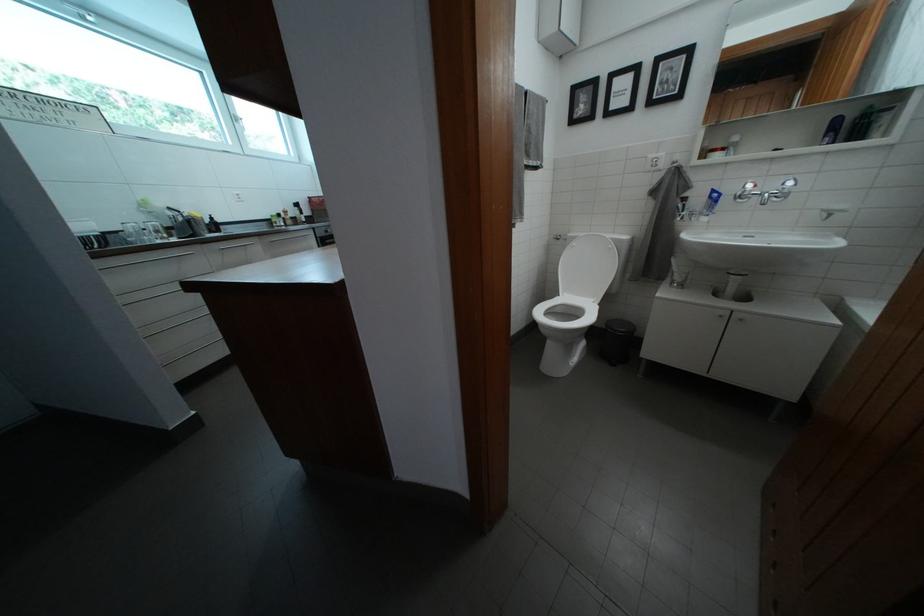
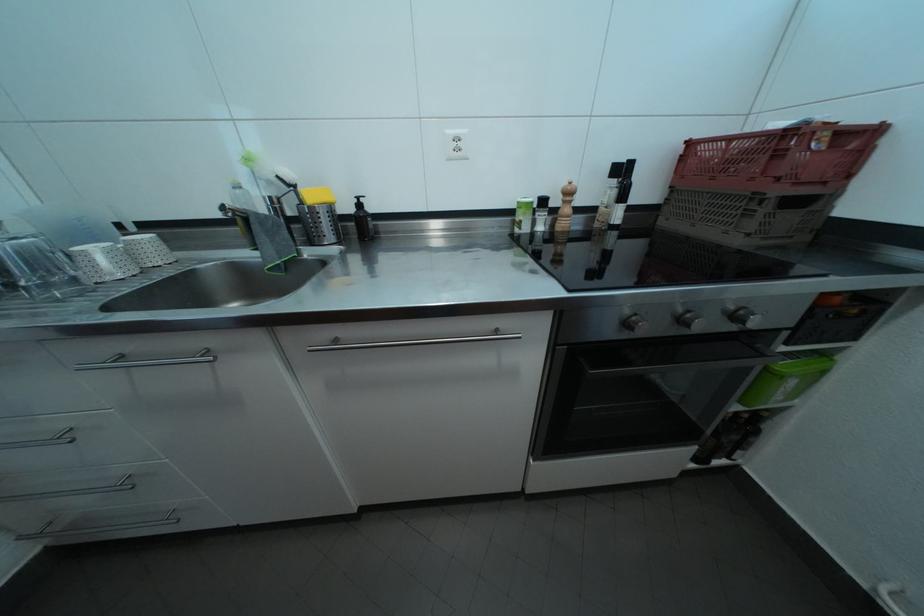
In the second image, find the point that corresponds to [292,221] in the first image.

(564, 208)